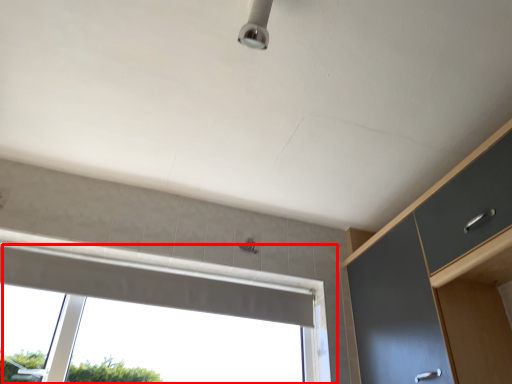
Question: From the image's perspective, where is window (annotated by the red box) located relative to dresser?

Choices:
 (A) below
 (B) above

Answer: (A)